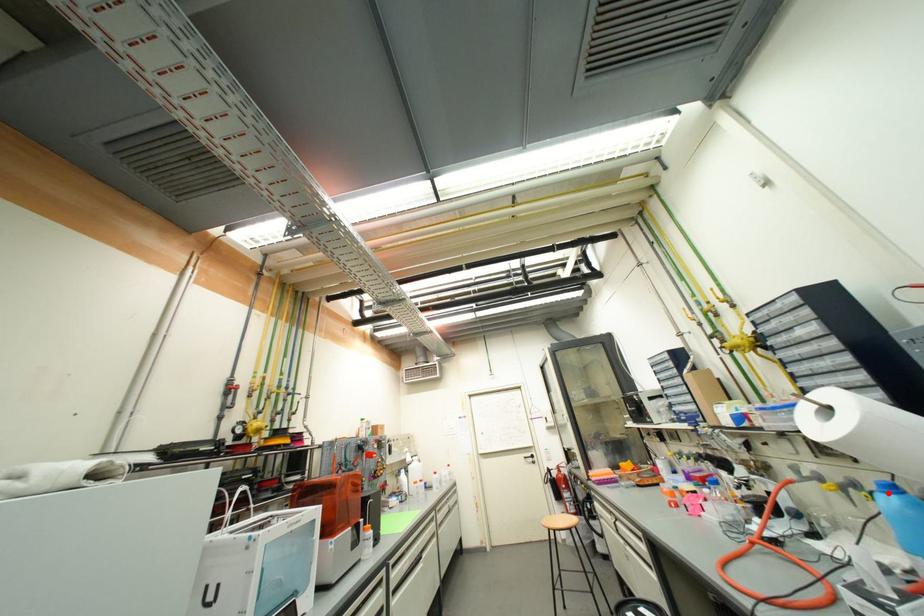
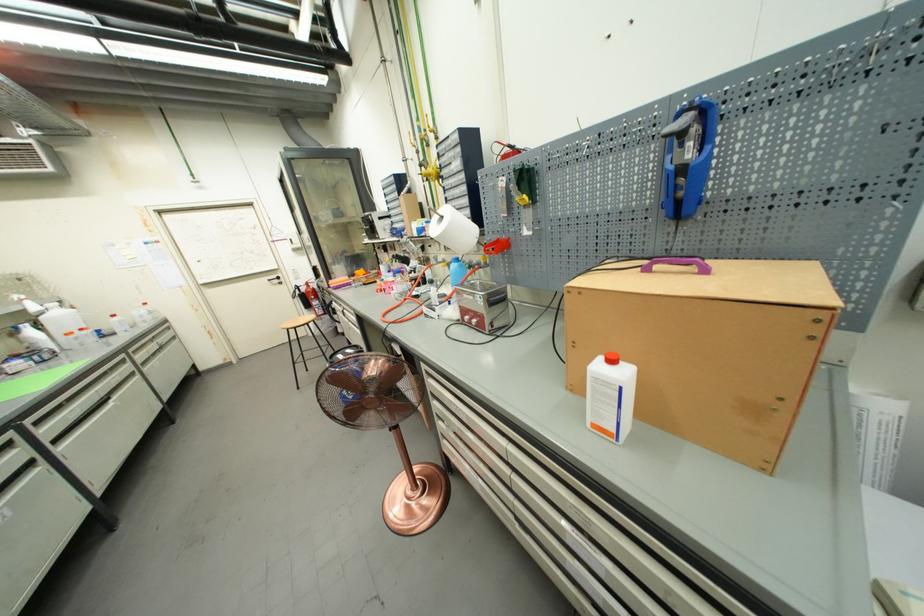
In the second image, find the point that corresponds to the highlighted location in the first image.

(458, 264)